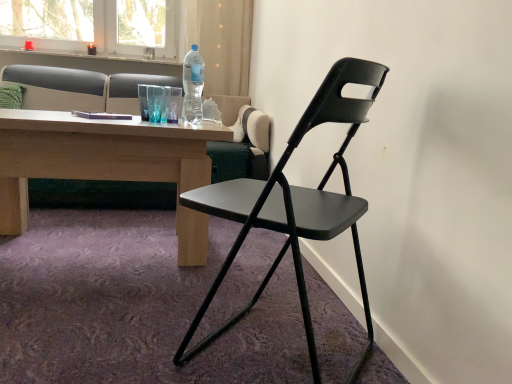
Where is `free region under matte black folding chair at center (from a real-world perspective)`? This screenshot has width=512, height=384. free region under matte black folding chair at center (from a real-world perspective) is located at coordinates [x=254, y=333].